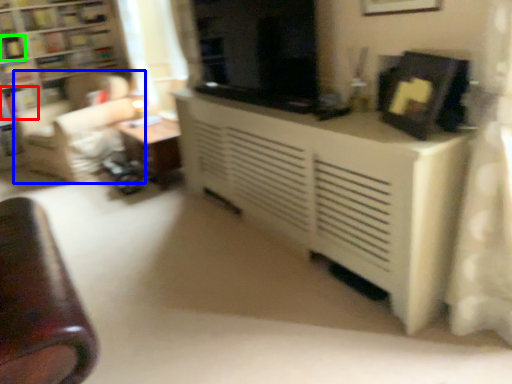
Question: Which object is positioned farthest from book (highlighted by a red box)? Select from swivel chair (highlighted by a blue box) and book (highlighted by a green box).

Choices:
 (A) swivel chair
 (B) book

Answer: (A)